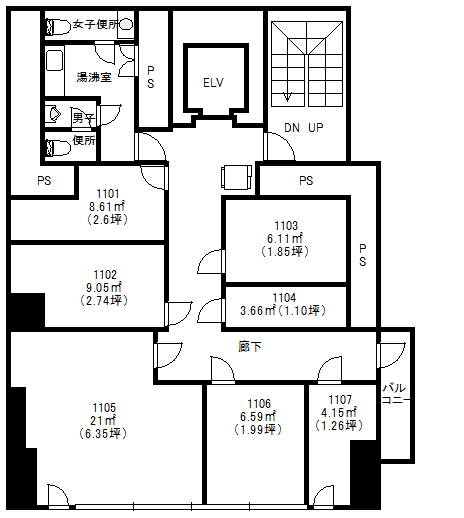
Locate an element on the screen. toilets is located at coordinates (57, 27), (63, 149).